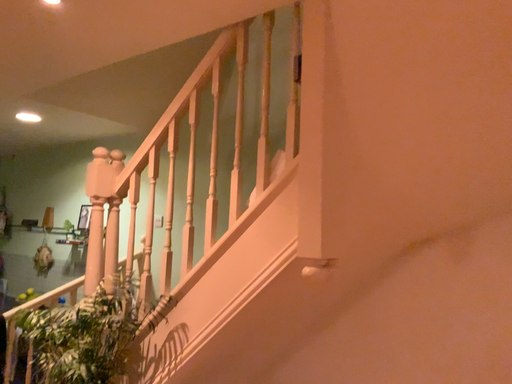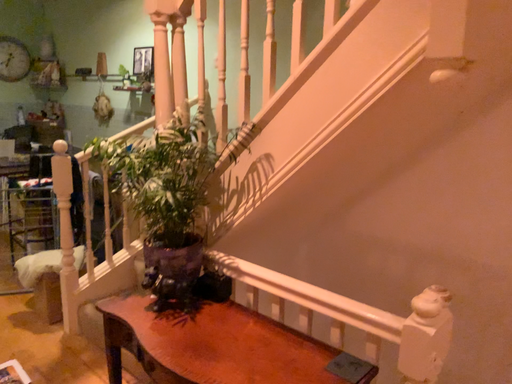
Question: Which way did the camera rotate in the video?

Choices:
 (A) rotated downward
 (B) rotated upward

Answer: (A)